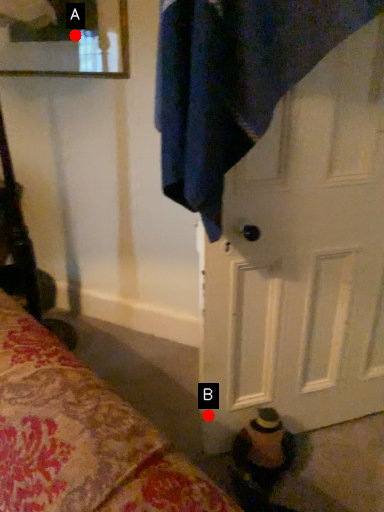
Question: Two points are circled on the image, labeled by A and B beside each circle. Which point is closer to the camera?

Choices:
 (A) A is closer
 (B) B is closer

Answer: (B)